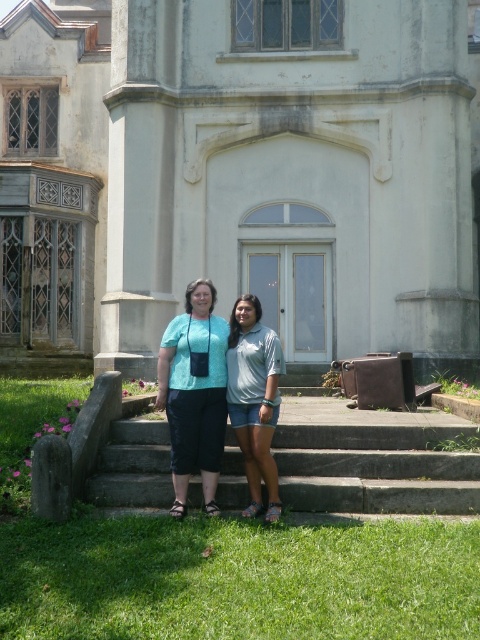
Question: Does green grass at lower center have a lesser width compared to gray concrete stairs at center?

Choices:
 (A) yes
 (B) no

Answer: (B)

Question: Among these points, which one is nearest to the camera?

Choices:
 (A) (412, 460)
 (B) (448, 600)
 (C) (217, 388)
 (D) (244, 406)

Answer: (B)

Question: In this image, where is matte teal blouse at center located relative to blue denim shorts at center?

Choices:
 (A) right
 (B) left

Answer: (B)

Question: Which point is closer to the camera taking this photo?

Choices:
 (A) (377, 438)
 (B) (204, 428)
 (C) (267, 429)

Answer: (C)

Question: Which of these objects is positioned farthest from the matte teal blouse at center?

Choices:
 (A) green grass at lower center
 (B) gray concrete stairs at center
 (C) blue denim shorts at center

Answer: (A)

Question: Is matte teal blouse at center positioned at the back of blue denim shorts at center?

Choices:
 (A) yes
 (B) no

Answer: (A)